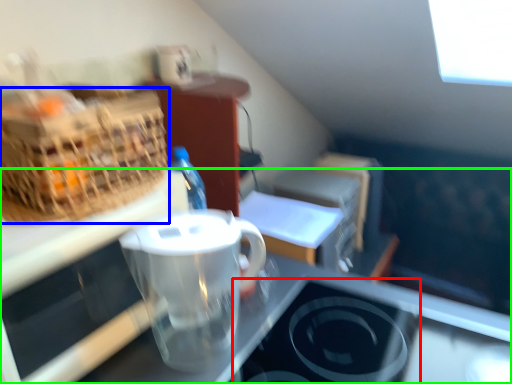
Question: Based on their relative distances, which object is nearer to appliance (highlighted by a red box)? Choose from picnic basket (highlighted by a blue box) and desk (highlighted by a green box).

Choices:
 (A) picnic basket
 (B) desk

Answer: (B)